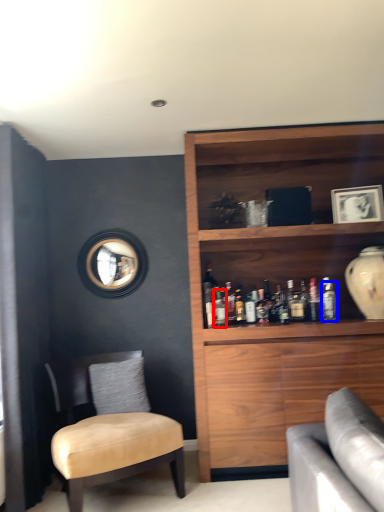
Question: Which of the following is the farthest to the observer, bottle (highlighted by a red box) or bottle (highlighted by a blue box)?

Choices:
 (A) bottle
 (B) bottle

Answer: (B)